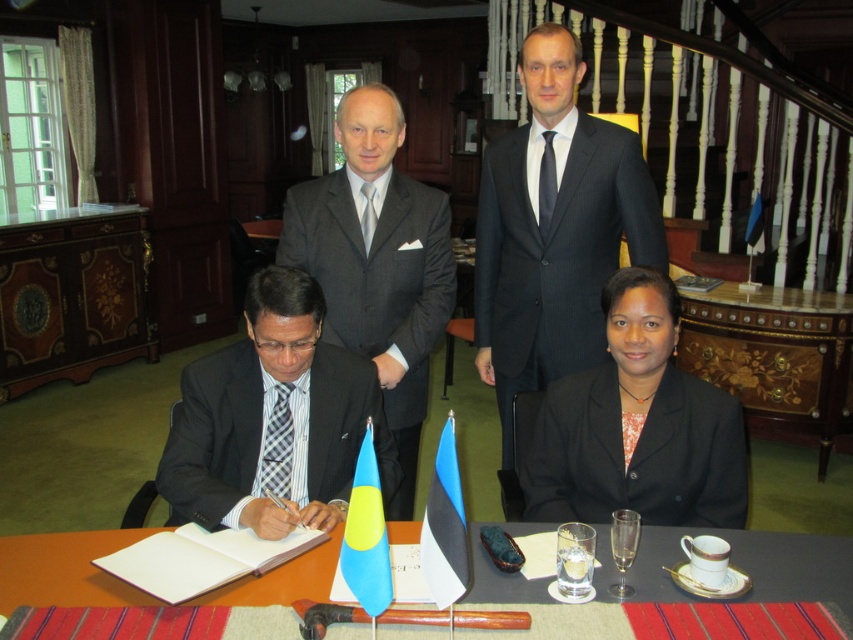
Is marble top table at center bigger than plaid fabric tie at lower left?

Indeed, marble top table at center has a larger size compared to plaid fabric tie at lower left.

Image resolution: width=853 pixels, height=640 pixels. What do you see at coordinates (775, 355) in the screenshot?
I see `marble top table at center` at bounding box center [775, 355].

Find the location of a particular element. This screenshot has width=853, height=640. marble top table at center is located at coordinates (775, 355).

Does black matte suit at lower right have a smaller size compared to black silk tie at upper center?

No, black matte suit at lower right is not smaller than black silk tie at upper center.

Who is lower down, black matte suit at lower right or black silk tie at upper center?

black matte suit at lower right is below.

Does point (676, 436) come closer to viewer compared to point (541, 221)?

Yes, point (676, 436) is in front of point (541, 221).

Where is `black matte suit at lower right`? black matte suit at lower right is located at coordinates (636, 452).

Is point (820, 589) closer to camera compared to point (364, 193)?

Yes, point (820, 589) is closer to viewer.

Does wooden table at lower center appear over silver/satin tie at upper center?

Actually, wooden table at lower center is below silver/satin tie at upper center.

Where is `wooden table at lower center`? Image resolution: width=853 pixels, height=640 pixels. wooden table at lower center is located at coordinates (755, 564).

Identify the location of wooden table at lower center. This screenshot has height=640, width=853. pyautogui.click(x=755, y=564).